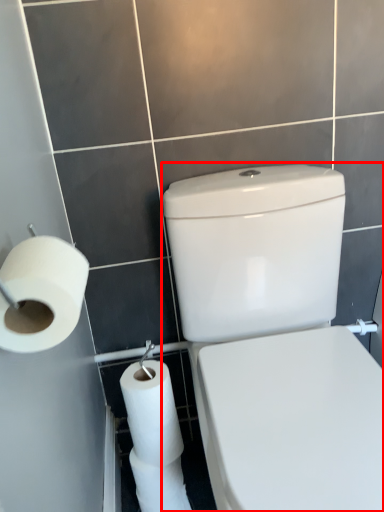
Question: From the image's perspective, where is porcelain (annotated by the red box) located in relation to toilet paper in the image?

Choices:
 (A) above
 (B) below

Answer: (B)